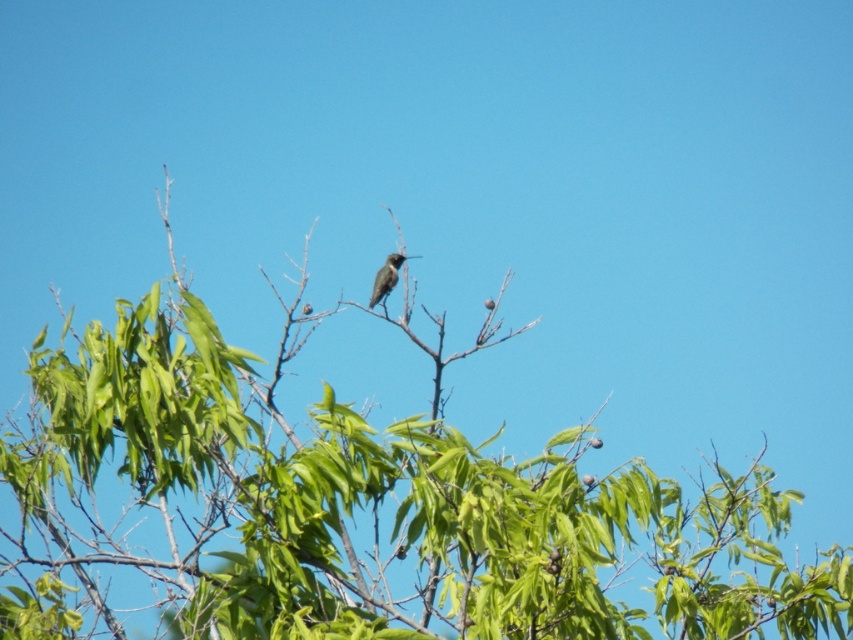
You are standing at the origin point of the image coordinate system. The origin is at the bottom left corner of the image. The coordinate system has a width of 1 and a height of 1. Which direction should you move to reach the green leafy tree at center?

The green leafy tree at center is located at coordinate point 0.791 on the x axis and 0.419 on the y axis. Since the origin is at the bottom left corner, moving towards the right along the x axis and slightly upwards along the y axis will lead you to the green leafy tree at center.

From the picture: You are a birdwatcher observing the scene from the ground. You notice the shiny brown bird at center and the green leafy tree at center. Which object is positioned higher in the image?

The shiny brown bird at center is positioned higher than the green leafy tree at center.

You are standing in a park and see the green leafy tree at center and the shiny brown bird at center. Which object is positioned more to the right side of the image?

The green leafy tree at center is positioned to the right of the shiny brown bird at center, so the green leafy tree at center is more to the right side of the image.